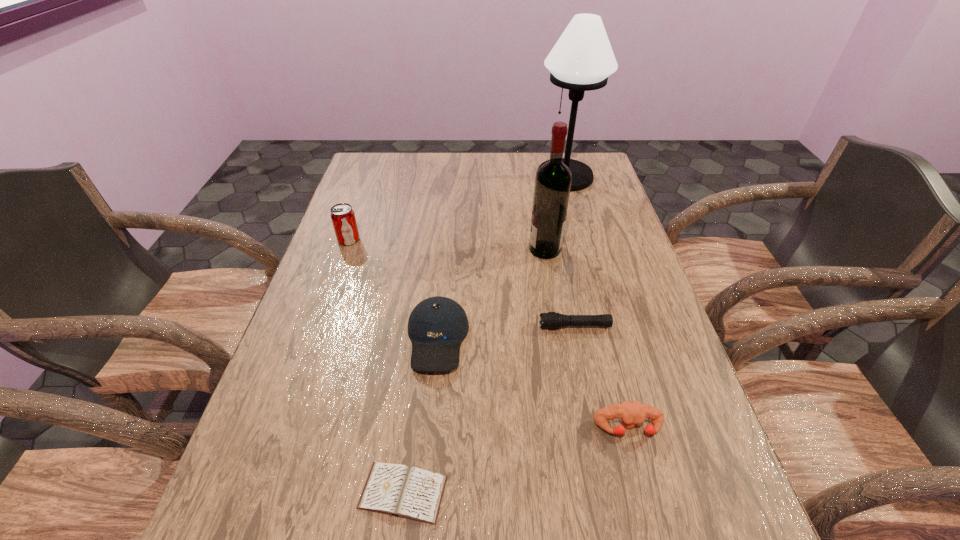
Where is `free space at the right edge of the desktop`? This screenshot has width=960, height=540. free space at the right edge of the desktop is located at coordinates (732, 511).

Image resolution: width=960 pixels, height=540 pixels. In the image, there is a desktop. In order to click on free space at the far left corner in this screenshot , I will do `click(390, 158)`.

This screenshot has width=960, height=540. Find the location of `vacant space that is in between the second shortest object and the shortest object`. vacant space that is in between the second shortest object and the shortest object is located at coordinates (489, 409).

Find the location of a particular element. vacant area between the table lamp and the shortest object is located at coordinates (484, 334).

What are the coordinates of `unoccupied area between the fourth shortest object and the second shortest object` in the screenshot? It's located at (506, 333).

Where is `empty space between the baseball cap and the shortest object`? Image resolution: width=960 pixels, height=540 pixels. empty space between the baseball cap and the shortest object is located at coordinates (420, 416).

Image resolution: width=960 pixels, height=540 pixels. I want to click on empty location between the sixth farthest object and the baseball cap, so coord(533,383).

Identify the location of free space between the nearest object and the leftmost object. (376, 366).

At what (x,y) coordinates should I click in order to perform the action: click on free space between the sixth shortest object and the second nearest object. Please return your answer as a coordinate pair (x, y). The width and height of the screenshot is (960, 540). Looking at the image, I should click on (587, 339).

Locate an element on the screen. vacant space in between the second shortest object and the baseball cap is located at coordinates (506, 333).